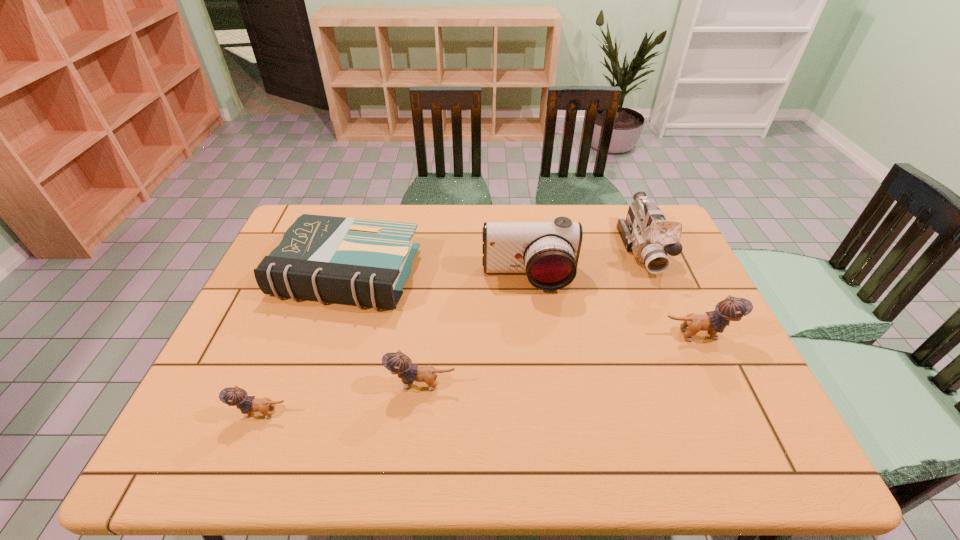
At what (x,y) coordinates should I click in order to perform the action: click on free space located on the front-facing side of the nearest kitten. Please return your answer as a coordinate pair (x, y). Image resolution: width=960 pixels, height=540 pixels. Looking at the image, I should click on (198, 413).

Identify the location of vacant region located 0.060m on the front-facing side of the nearest kitten. This screenshot has height=540, width=960. (206, 413).

You are a GUI agent. You are given a task and a screenshot of the screen. Output one action in this format:
    pyautogui.click(x=<x>, y=<y>)
    Task: Click on the free spot located on the front-facing side of the second kitten from left to right
    
    Given the screenshot: What is the action you would take?
    pyautogui.click(x=350, y=384)

Where is `vacant space located 0.240m on the front-facing side of the second kitten from left to right`? vacant space located 0.240m on the front-facing side of the second kitten from left to right is located at coordinates (288, 384).

Where is `free space located 0.100m on the front-facing side of the second kitten from left to right`? This screenshot has width=960, height=540. free space located 0.100m on the front-facing side of the second kitten from left to right is located at coordinates (347, 384).

The image size is (960, 540). What are the coordinates of `free space located on the right of the paperback book` in the screenshot? It's located at (437, 273).

At what (x,y) coordinates should I click in order to perform the action: click on vacant region located 0.330m on the front-facing side of the right camcorder. Please return your answer as a coordinate pair (x, y). The width and height of the screenshot is (960, 540). Looking at the image, I should click on (695, 371).

Image resolution: width=960 pixels, height=540 pixels. Identify the location of free space located on the surface of the fourth object from left to right. (537, 342).

Identify the location of paperback book that is at the far edge. The width and height of the screenshot is (960, 540). (366, 262).

The height and width of the screenshot is (540, 960). I want to click on camcorder situated at the far edge, so point(646,232).